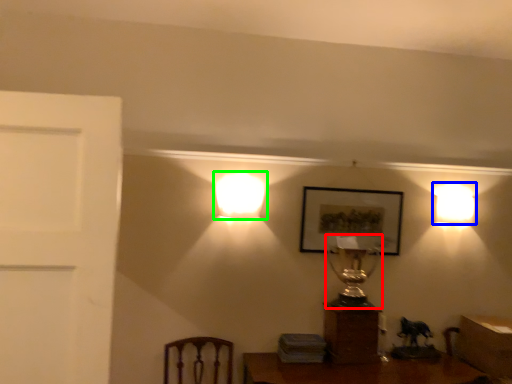
Question: Based on their relative distances, which object is farther from table lamp (highlighted by a red box)? Choose from lamp (highlighted by a blue box) and lamp (highlighted by a green box).

Choices:
 (A) lamp
 (B) lamp

Answer: (B)